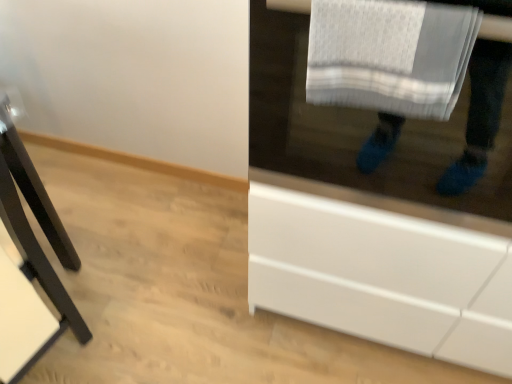
At what (x,y) coordinates should I click in order to perform the action: click on free location to the right of black matte table at left. Please return your answer as a coordinate pair (x, y). The image size is (512, 384). Looking at the image, I should click on (156, 315).